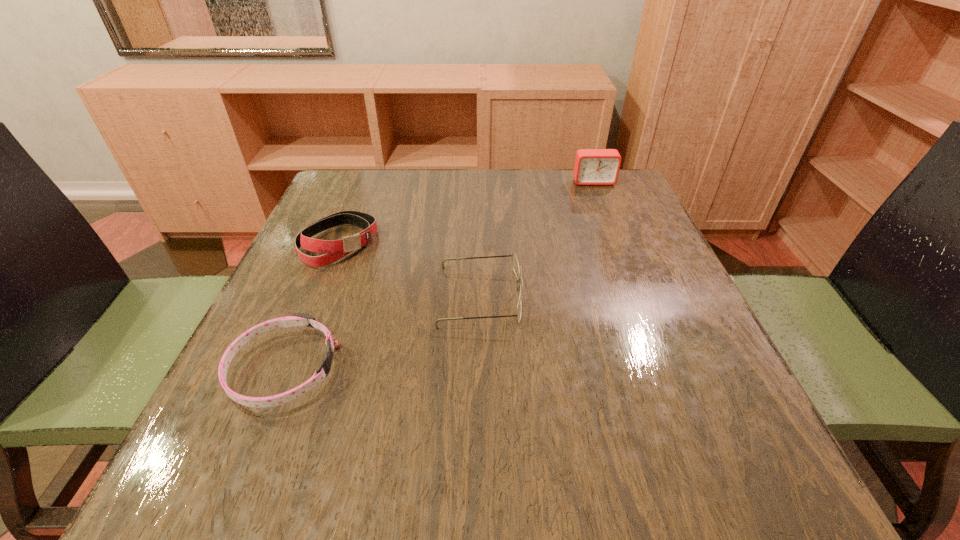
This screenshot has width=960, height=540. I want to click on the farthest object, so click(592, 166).

Where is `the tallest object`? The image size is (960, 540). the tallest object is located at coordinates (592, 166).

You are a GUI agent. You are given a task and a screenshot of the screen. Output one action in this format:
    pyautogui.click(x=<x>, y=<y>)
    Task: Click on the taller dog collar
    This screenshot has width=960, height=540.
    Given the screenshot: What is the action you would take?
    pyautogui.click(x=333, y=250)

The height and width of the screenshot is (540, 960). What are the coordinates of `spectacles` in the screenshot? It's located at (515, 264).

Identify the location of the shorter dog collar. This screenshot has width=960, height=540. (298, 319).

Locate an element on the screen. the nearest object is located at coordinates (x=298, y=319).

Where is `free space located 0.320m on the front-facing side of the alarm clock`? Image resolution: width=960 pixels, height=540 pixels. free space located 0.320m on the front-facing side of the alarm clock is located at coordinates (625, 262).

The width and height of the screenshot is (960, 540). Find the location of `vacant space situated on the right of the farther dog collar`. vacant space situated on the right of the farther dog collar is located at coordinates (401, 244).

Find the location of a particular element. vacant region located on the front-facing side of the third object from left to right is located at coordinates (629, 296).

Locate an element on the screen. The image size is (960, 540). free region located with the buckle on the nearer dog collar is located at coordinates (474, 369).